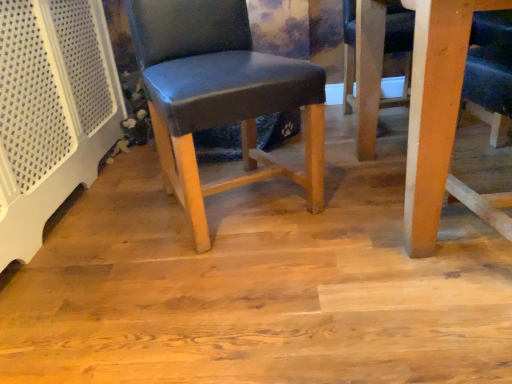
Question: Does wooden table at lower right have a lesser height compared to matte wood floor at center?

Choices:
 (A) yes
 (B) no

Answer: (B)

Question: Is matte wood floor at center inside wooden table at lower right?

Choices:
 (A) no
 (B) yes

Answer: (A)

Question: Does wooden table at lower right have a smaller size compared to matte wood floor at center?

Choices:
 (A) yes
 (B) no

Answer: (B)

Question: Is the depth of wooden table at lower right less than that of matte wood floor at center?

Choices:
 (A) yes
 (B) no

Answer: (A)

Question: Considering the relative sizes of wooden table at lower right and matte wood floor at center in the image provided, is wooden table at lower right taller than matte wood floor at center?

Choices:
 (A) no
 (B) yes

Answer: (B)

Question: In the image, is wooden table at lower right positioned in front of or behind matte blue leather chair at center?

Choices:
 (A) front
 (B) behind

Answer: (A)

Question: Is wooden table at lower right situated inside matte blue leather chair at center or outside?

Choices:
 (A) inside
 (B) outside

Answer: (B)

Question: From a real-world perspective, is wooden table at lower right physically located above or below matte blue leather chair at center?

Choices:
 (A) above
 (B) below

Answer: (B)

Question: Looking at the image, does wooden table at lower right seem bigger or smaller compared to matte blue leather chair at center?

Choices:
 (A) small
 (B) big

Answer: (B)

Question: From the image's perspective, relative to wooden table at lower right, is matte blue leather chair at center above or below?

Choices:
 (A) below
 (B) above

Answer: (A)

Question: From a real-world perspective, is matte blue leather chair at center physically located above or below wooden table at lower right?

Choices:
 (A) above
 (B) below

Answer: (A)

Question: Is matte blue leather chair at center bigger or smaller than wooden table at lower right?

Choices:
 (A) big
 (B) small

Answer: (B)

Question: Considering the positions of point (140, 11) and point (414, 119), is point (140, 11) closer or farther from the camera than point (414, 119)?

Choices:
 (A) closer
 (B) farther

Answer: (B)

Question: Would you say matte wood floor at center is to the left or to the right of wooden table at lower right in the picture?

Choices:
 (A) right
 (B) left

Answer: (B)

Question: Considering the positions of matte wood floor at center and wooden table at lower right in the image, is matte wood floor at center bigger or smaller than wooden table at lower right?

Choices:
 (A) big
 (B) small

Answer: (B)